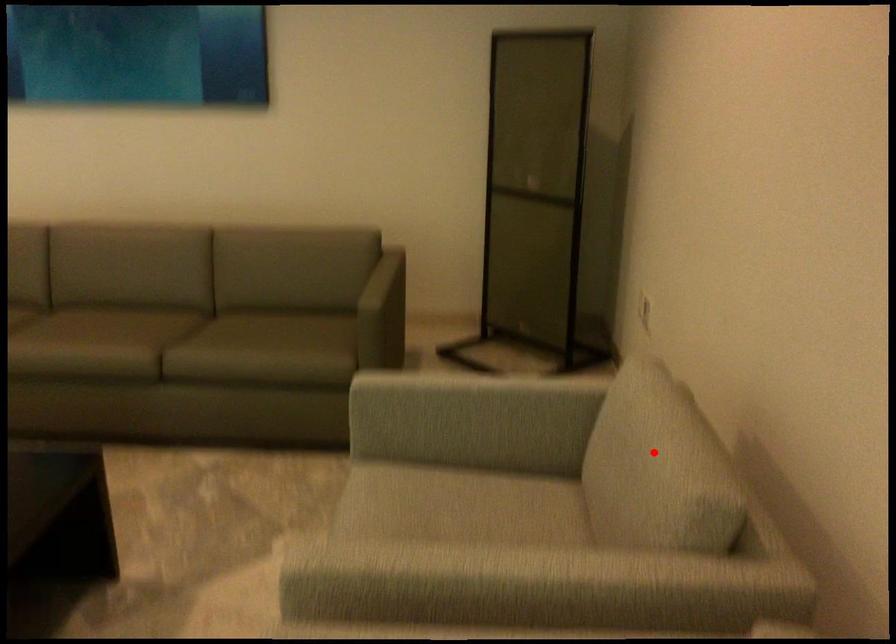
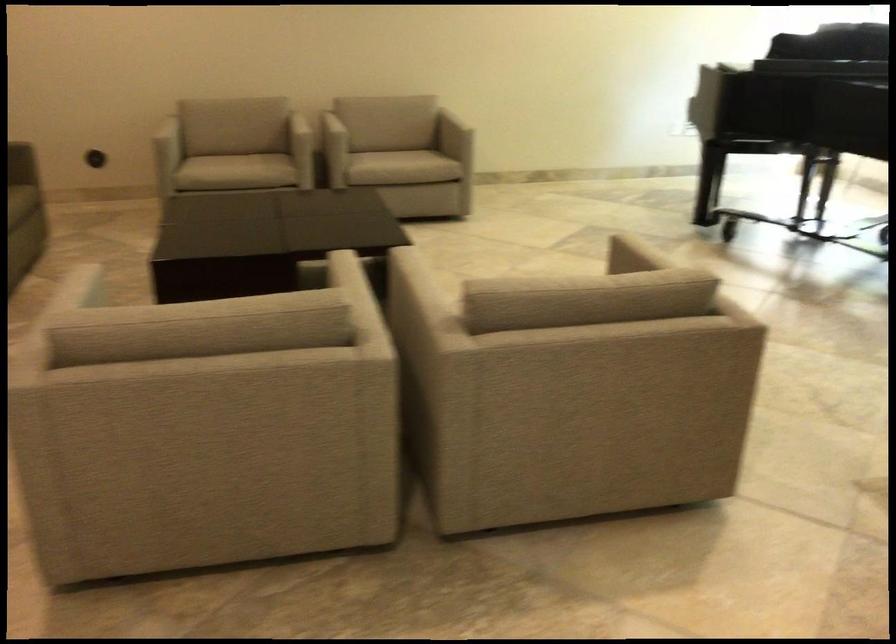
Question: A red point is marked in image1. In image2, is the corresponding 3D point closer to the camera or farther? Reply with the corresponding letter.

Choices:
 (A) The corresponding 3D point is closer.
 (B) The corresponding 3D point is farther.

Answer: (B)